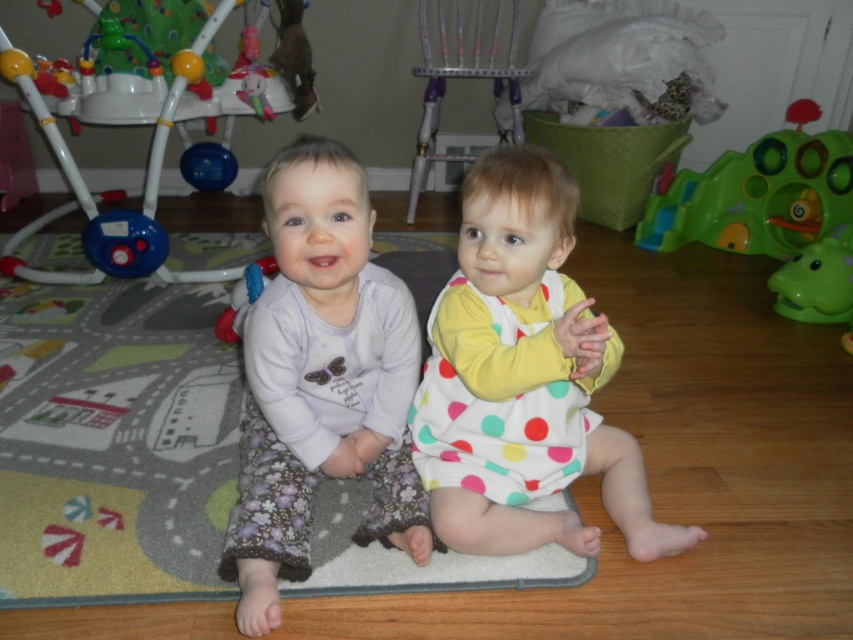
Question: Which object appears farthest from the camera in this image?

Choices:
 (A) gray fabric mat at center
 (B) white polka dot dress at center
 (C) green plastic toy at right

Answer: (C)

Question: Which object is positioned farthest from the gray fabric mat at center?

Choices:
 (A) white plastic baby walker at left
 (B) matte purple pajamas at center
 (C) green plastic toy at right

Answer: (C)

Question: Is gray fabric mat at center behind white plastic baby walker at left?

Choices:
 (A) yes
 (B) no

Answer: (B)

Question: Which point is farther to the camera?

Choices:
 (A) gray fabric mat at center
 (B) white polka dot dress at center
 (C) matte purple pajamas at center

Answer: (A)

Question: Is gray fabric mat at center wider than matte purple pajamas at center?

Choices:
 (A) no
 (B) yes

Answer: (B)

Question: Does white polka dot dress at center lie behind white plastic baby walker at left?

Choices:
 (A) yes
 (B) no

Answer: (B)